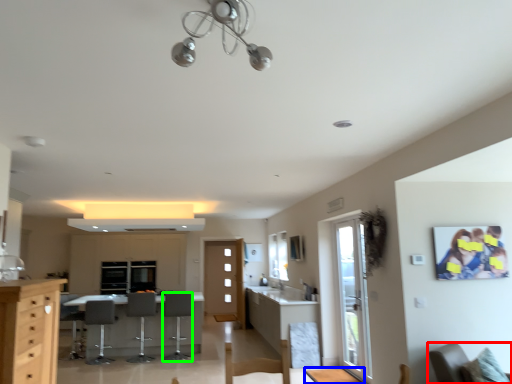
Question: Estimate the real-world distances between objects in this image. Which object is closer to chair (highlighted by a red box), table (highlighted by a blue box) or armchair (highlighted by a green box)?

Choices:
 (A) table
 (B) armchair

Answer: (A)